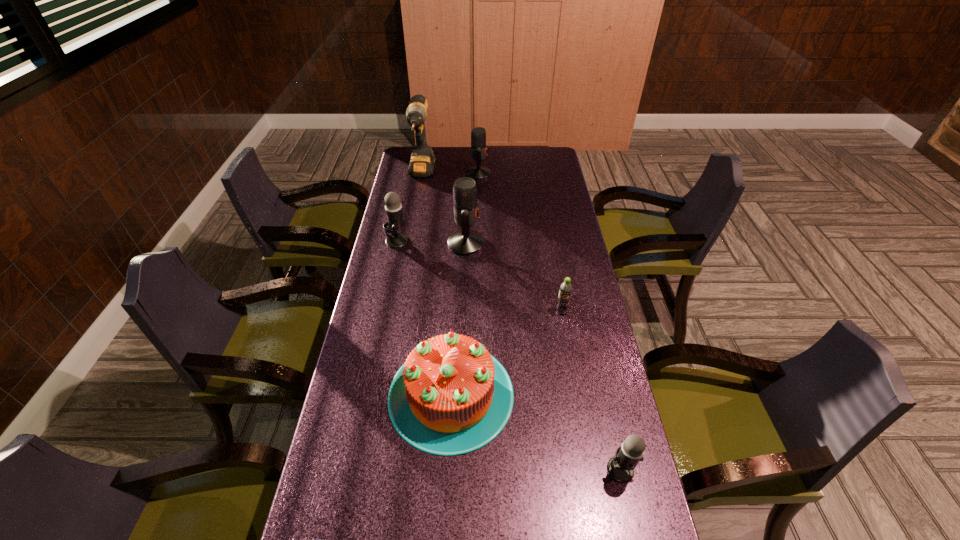
At what (x,y) coordinates should I click in order to perform the action: click on the tallest object. Please return your answer as a coordinate pair (x, y). Looking at the image, I should click on (422, 161).

Image resolution: width=960 pixels, height=540 pixels. Identify the location of the nearer red microphone. (465, 242).

The height and width of the screenshot is (540, 960). I want to click on the tallest microphone, so (x=465, y=242).

This screenshot has width=960, height=540. Find the location of `the farther red microphone`. the farther red microphone is located at coordinates (478, 134).

In order to click on the smaller red microphone in this screenshot , I will do 478,134.

You are a GUI agent. You are given a task and a screenshot of the screen. Output one action in this format:
    pyautogui.click(x=<x>, y=<y>)
    Task: Click on the leftmost microphone
    Image resolution: width=960 pixels, height=540 pixels.
    Given the screenshot: What is the action you would take?
    pyautogui.click(x=395, y=221)

Identify the location of the farther gray microphone. The height and width of the screenshot is (540, 960). (395, 221).

The height and width of the screenshot is (540, 960). I want to click on cake, so click(x=451, y=397).

The height and width of the screenshot is (540, 960). In order to click on the rightmost object in this screenshot , I will do `click(620, 467)`.

What are the coordinates of `the right gray microphone` in the screenshot? It's located at (620, 467).